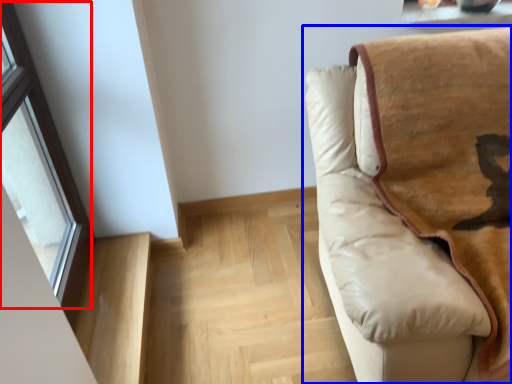
Question: Which of the following is the farthest to the observer, window (highlighted by a red box) or studio couch (highlighted by a blue box)?

Choices:
 (A) window
 (B) studio couch

Answer: (A)